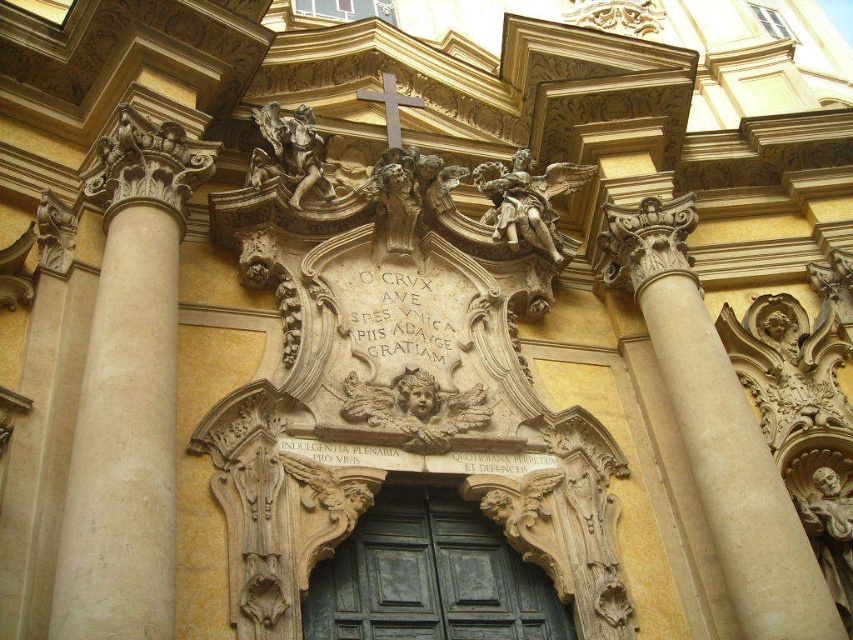
Which of these two, white marble cherub at center or polished bronze angel at upper center, stands shorter?

white marble cherub at center

Can you confirm if white marble cherub at center is thinner than polished bronze angel at upper center?

Yes.

Between point (422, 378) and point (555, 189), which one is positioned behind?

Positioned behind is point (555, 189).

This screenshot has width=853, height=640. I want to click on white marble cherub at center, so click(415, 408).

Who is shorter, beige stone column at right or polished bronze angel at upper center?

Standing shorter between the two is polished bronze angel at upper center.

Is point (769, 582) in front of point (517, 168)?

Yes.

Identify the location of beige stone column at right. (718, 428).

Which of these two, beige stone column at right or white marble cherub at center, stands shorter?

Standing shorter between the two is white marble cherub at center.

Locate an element on the screen. The width and height of the screenshot is (853, 640). beige stone column at right is located at coordinates (718, 428).